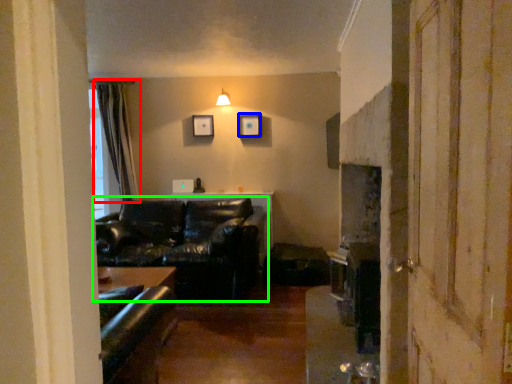
Question: Estimate the real-world distances between objects in this image. Which object is closer to curtain (highlighted by a red box), picture frame (highlighted by a blue box) or studio couch (highlighted by a green box)?

Choices:
 (A) picture frame
 (B) studio couch

Answer: (B)